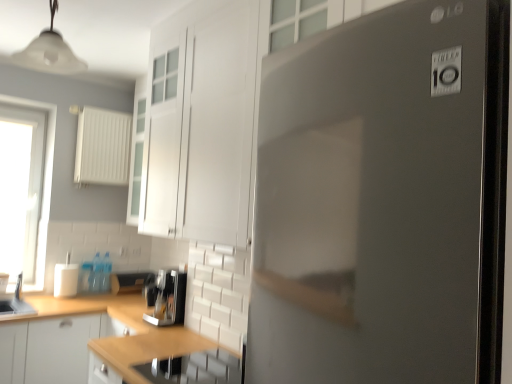
Question: Considering the relative sizes of white glossy cup at lower left, the second appliance from the bottom, and white glossy cabinet at upper center, marked as the 2th cabinetry in a bottom-to-top arrangement, in the image provided, is white glossy cup at lower left, the second appliance from the bottom, smaller than white glossy cabinet at upper center, marked as the 2th cabinetry in a bottom-to-top arrangement,?

Choices:
 (A) no
 (B) yes

Answer: (B)

Question: Is white glossy cup at lower left, which is counted as the second appliance, starting from the back, at the left side of white glossy cabinet at upper center, marked as the 2th cabinetry in a bottom-to-top arrangement?

Choices:
 (A) yes
 (B) no

Answer: (A)

Question: Is white glossy cup at lower left, which appears as the first appliance when viewed from the left, shorter than white glossy cabinet at upper center, the first cabinetry viewed from the front?

Choices:
 (A) yes
 (B) no

Answer: (A)

Question: Is white glossy cup at lower left, which appears as the first appliance when viewed from the left, taller than white glossy cabinet at upper center, marked as the 2th cabinetry in a bottom-to-top arrangement?

Choices:
 (A) yes
 (B) no

Answer: (B)

Question: Is white glossy cup at lower left, which ranks as the second appliance in top-to-bottom order, oriented away from white glossy cabinet at upper center, the 1th cabinetry viewed from the top?

Choices:
 (A) yes
 (B) no

Answer: (B)

Question: Would you say white matte cabinet at lower left, marked as the 2th cabinetry in a right-to-left arrangement, is to the left or to the right of white plastic radiator at upper left, which appears as the second appliance when viewed from the left, in the picture?

Choices:
 (A) left
 (B) right

Answer: (A)

Question: Looking at the image, does white matte cabinet at lower left, positioned as the 1th cabinetry in bottom-to-top order, seem bigger or smaller compared to white plastic radiator at upper left, which is the 2th appliance from right to left?

Choices:
 (A) big
 (B) small

Answer: (A)

Question: Considering their positions, is white matte cabinet at lower left, the first cabinetry when ordered from left to right, located in front of or behind white plastic radiator at upper left, the 1th appliance viewed from the back?

Choices:
 (A) behind
 (B) front

Answer: (B)

Question: From a real-world perspective, is white matte cabinet at lower left, the first cabinetry when ordered from left to right, physically located above or below white plastic radiator at upper left, which is the first appliance from top to bottom?

Choices:
 (A) above
 (B) below

Answer: (B)

Question: Is wooden countertop at lower center in front of or behind satin black fridge at center in the image?

Choices:
 (A) behind
 (B) front

Answer: (A)

Question: Is point (231, 365) closer or farther from the camera than point (264, 359)?

Choices:
 (A) farther
 (B) closer

Answer: (A)

Question: Looking at their shapes, would you say wooden countertop at lower center is wider or thinner than satin black fridge at center?

Choices:
 (A) thin
 (B) wide

Answer: (A)

Question: From a real-world perspective, relative to satin black fridge at center, is wooden countertop at lower center vertically above or below?

Choices:
 (A) above
 (B) below

Answer: (B)

Question: Which is correct: stainless steel sink at lower center, which is the 3th appliance in left-to-right order, is inside white glossy cabinet at upper center, placed as the second cabinetry when sorted from left to right, or outside of it?

Choices:
 (A) outside
 (B) inside

Answer: (A)

Question: Considering the positions of stainless steel sink at lower center, which is the 3th appliance in left-to-right order, and white glossy cabinet at upper center, marked as the 2th cabinetry in a back-to-front arrangement, in the image, is stainless steel sink at lower center, which is the 3th appliance in left-to-right order, taller or shorter than white glossy cabinet at upper center, marked as the 2th cabinetry in a back-to-front arrangement,?

Choices:
 (A) short
 (B) tall

Answer: (A)